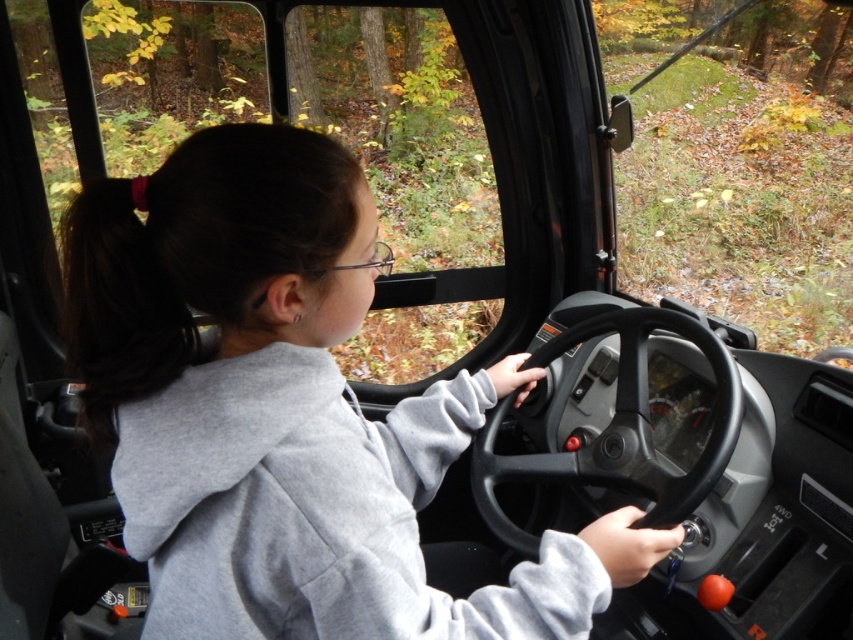
You are standing 30 inches away from the vehicle. Can you see the dark brown hair at left from your current position?

The dark brown hair at left is 27.74 inches away from the viewer. Since you are standing 30 inches away from the vehicle, you can see the dark brown hair at left because you are within the distance.

You are a safety inspector checking the visibility of the driver in the tractor cabin. You notice the dark brown hair at left and the black rubber steering wheel at center. Based on their widths, which object is wider?

The black rubber steering wheel at center is wider than the dark brown hair at left because the dark brown hair at left has a smaller width.